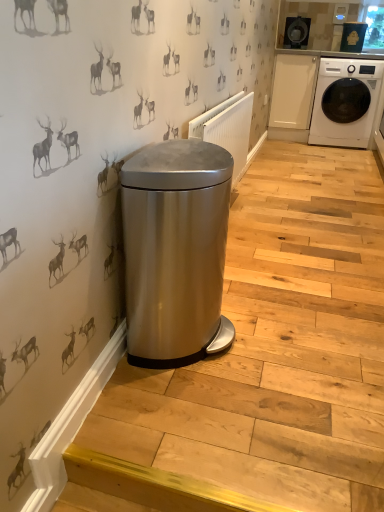
Where is `vacant space behind satin silver radiator at center`? This screenshot has width=384, height=512. vacant space behind satin silver radiator at center is located at coordinates (267, 188).